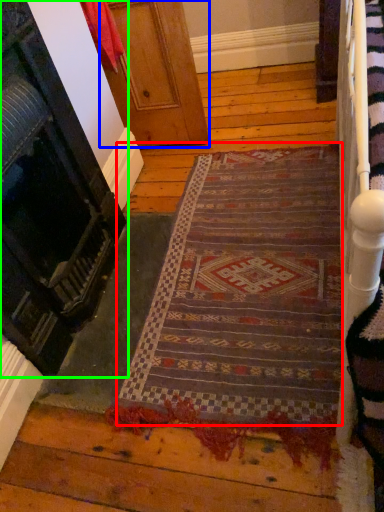
Question: Estimate the real-world distances between objects in this image. Which object is farther from mat (highlighted by a red box), door (highlighted by a blue box) or door (highlighted by a green box)?

Choices:
 (A) door
 (B) door

Answer: (A)